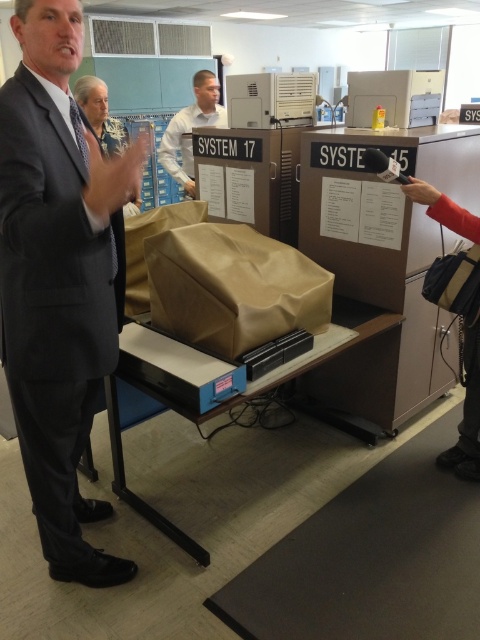
Consider the image. Can you confirm if matte black suit at left is positioned below brown paper bag at center?

Yes, matte black suit at left is below brown paper bag at center.

Can you confirm if matte black suit at left is positioned to the left of brown paper bag at center?

Indeed, matte black suit at left is positioned on the left side of brown paper bag at center.

Does point (106, 234) lie in front of point (248, 237)?

That is True.

You are a GUI agent. You are given a task and a screenshot of the screen. Output one action in this format:
    pyautogui.click(x=<x>, y=<y>)
    Task: Click on the matte black suit at left
    This screenshot has width=480, height=640.
    Given the screenshot: What is the action you would take?
    pyautogui.click(x=59, y=278)

Does brown paper bag at center have a greater height compared to white shirt at center?

Incorrect, brown paper bag at center's height is not larger of white shirt at center's.

Does point (250, 253) come behind point (193, 88)?

No, (250, 253) is closer to viewer.

Does point (269, 253) come behind point (168, 157)?

That is False.

This screenshot has height=640, width=480. What are the coordinates of `brown paper bag at center` in the screenshot? It's located at (232, 288).

Which is in front, point (25, 134) or point (183, 129)?

Point (25, 134)

Can you confirm if matte black suit at left is positioned above white shirt at center?

Incorrect, matte black suit at left is not positioned above white shirt at center.

Find the location of a particular element. matte black suit at left is located at coordinates (59, 278).

You are a GUI agent. You are given a task and a screenshot of the screen. Output one action in this format:
    pyautogui.click(x=<x>, y=<y>)
    Task: Click on the matte black suit at left
    This screenshot has height=640, width=480.
    Given the screenshot: What is the action you would take?
    pyautogui.click(x=59, y=278)